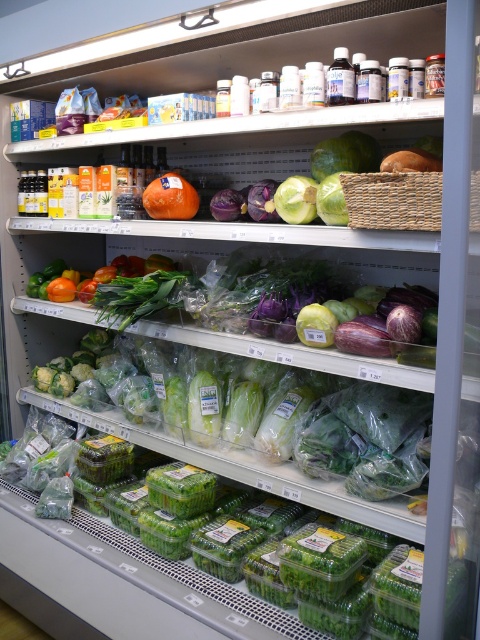
Can you confirm if woven straw basket at center is positioned above green matte cabbage at center?

Actually, woven straw basket at center is below green matte cabbage at center.

Measure the distance from woven straw basket at center to green matte cabbage at center.

12.33 inches

Where is `woven straw basket at center`? The width and height of the screenshot is (480, 640). woven straw basket at center is located at coordinates (394, 200).

This screenshot has width=480, height=640. Find the location of `woven straw basket at center`. woven straw basket at center is located at coordinates (394, 200).

Between woven straw basket at center and orange matte at center, which one is positioned higher?

orange matte at center is higher up.

The width and height of the screenshot is (480, 640). What do you see at coordinates (394, 200) in the screenshot?
I see `woven straw basket at center` at bounding box center [394, 200].

You are a GUI agent. You are given a task and a screenshot of the screen. Output one action in this format:
    pyautogui.click(x=<x>, y=<y>)
    Task: Click on the woven straw basket at center
    The height and width of the screenshot is (640, 480).
    Given the screenshot: What is the action you would take?
    pyautogui.click(x=394, y=200)

Can you confirm if green plastic containers at center is positioned above green matte cabbage at center?

Incorrect, green plastic containers at center is not positioned above green matte cabbage at center.

Is green plastic containers at center further to the viewer compared to green matte cabbage at center?

No.

In order to click on green plastic containers at center in this screenshot , I will do `click(133, 584)`.